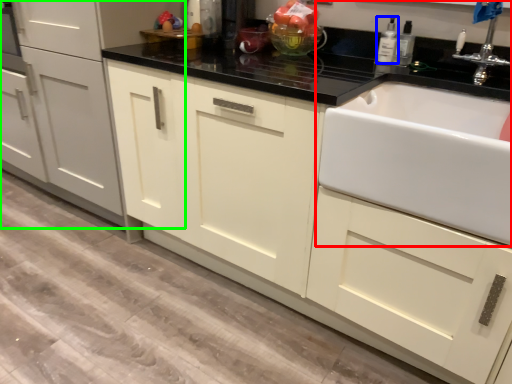
Question: Considering the real-world distances, which object is farthest from sink (highlighted by a red box)? bottle (highlighted by a blue box) or cabinetry (highlighted by a green box)?

Choices:
 (A) bottle
 (B) cabinetry

Answer: (B)